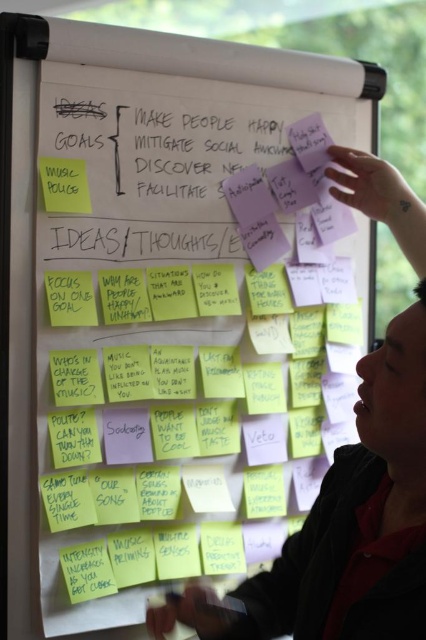
Question: Can you confirm if dark skin at upper right is wider than yellow sticky note at left?

Choices:
 (A) no
 (B) yes

Answer: (B)

Question: Which of the following is the farthest from the observer?

Choices:
 (A) dark skin at upper right
 (B) yellow sticky note at left

Answer: (B)

Question: Does dark skin at upper right appear on the right side of yellow sticky note at left?

Choices:
 (A) no
 (B) yes

Answer: (B)

Question: Which object is closer to the camera taking this photo?

Choices:
 (A) dark skin at upper right
 (B) yellow sticky note at left

Answer: (A)

Question: Does dark skin at upper right appear under yellow sticky note at left?

Choices:
 (A) no
 (B) yes

Answer: (B)

Question: Which point is farther from the camera taking this photo?

Choices:
 (A) (377, 401)
 (B) (89, 209)

Answer: (B)